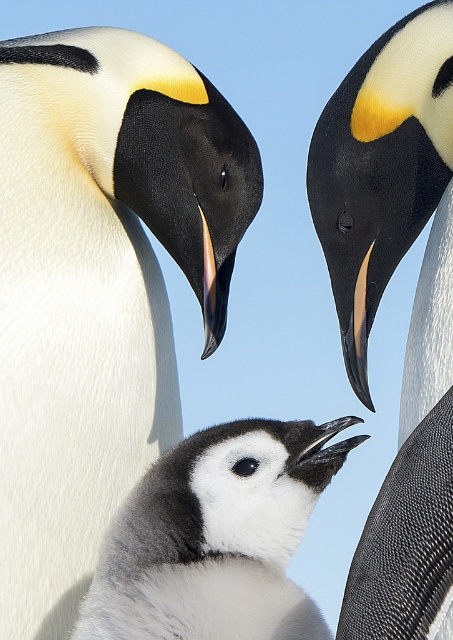
Is point (92, 109) in front of point (241, 532)?

No, it is behind (241, 532).

Who is higher up, white fluffy penguin chick at center or soft gray down at center?

white fluffy penguin chick at center is above.

At what (x,y) coordinates should I click in order to perform the action: click on white fluffy penguin chick at center. Please return your answer as a coordinate pair (x, y). The height and width of the screenshot is (640, 453). Looking at the image, I should click on (100, 288).

The image size is (453, 640). In order to click on white fluffy penguin chick at center in this screenshot , I will do `click(100, 288)`.

Can you confirm if white matte penguin at center is positioned to the right of soft gray down at center?

Indeed, white matte penguin at center is positioned on the right side of soft gray down at center.

What do you see at coordinates (413, 308) in the screenshot? I see `white matte penguin at center` at bounding box center [413, 308].

Identify the location of white matte penguin at center. The height and width of the screenshot is (640, 453). (413, 308).

Can you confirm if white fluffy penguin chick at center is positioned to the left of white matte penguin at center?

Indeed, white fluffy penguin chick at center is positioned on the left side of white matte penguin at center.

Between white fluffy penguin chick at center and white matte penguin at center, which one has more height?

white fluffy penguin chick at center

In order to click on white fluffy penguin chick at center in this screenshot , I will do `click(100, 288)`.

Locate an element on the screen. The height and width of the screenshot is (640, 453). white fluffy penguin chick at center is located at coordinates (100, 288).